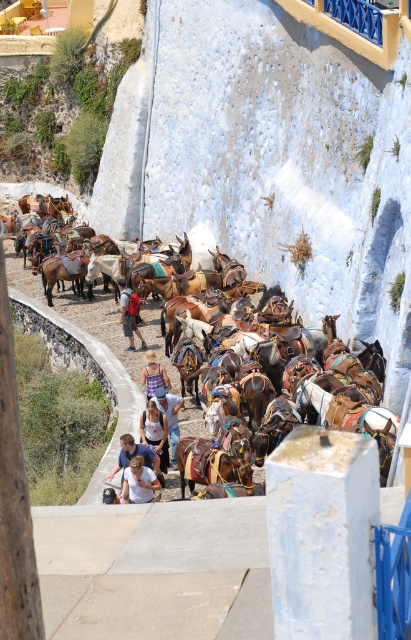
Which is more to the left, red backpack at center or purple cotton dress at center?

red backpack at center

Between red backpack at center and purple cotton dress at center, which one has more height?

With more height is red backpack at center.

Does point (138, 307) lie in front of point (166, 384)?

No, (138, 307) is further to viewer.

You are a GUI agent. You are given a task and a screenshot of the screen. Output one action in this format:
    pyautogui.click(x=<x>, y=<y>)
    Task: Click on the red backpack at center
    
    Given the screenshot: What is the action you would take?
    pyautogui.click(x=129, y=314)

Who is more distant from viewer, (71, 312) or (159, 444)?

Positioned behind is point (71, 312).

You are a GUI agent. You are given a task and a screenshot of the screen. Output one action in this format:
    pyautogui.click(x=<x>, y=<y>)
    Task: Click on the brown leather saddle at center
    The image size is (411, 640).
    Given the screenshot: What is the action you would take?
    pyautogui.click(x=99, y=324)

Can you confirm if light blue denim shorts at center is positioned to the left of purple cotton dress at center?

No, light blue denim shorts at center is not to the left of purple cotton dress at center.

Who is taller, light blue denim shorts at center or purple cotton dress at center?

light blue denim shorts at center is taller.

Is point (164, 461) farther from camera compared to point (154, 381)?

No, (164, 461) is closer to viewer.

At what (x,y) coordinates should I click in order to perform the action: click on light blue denim shorts at center. Please return your answer as a coordinate pair (x, y). The height and width of the screenshot is (640, 411). Looking at the image, I should click on (154, 433).